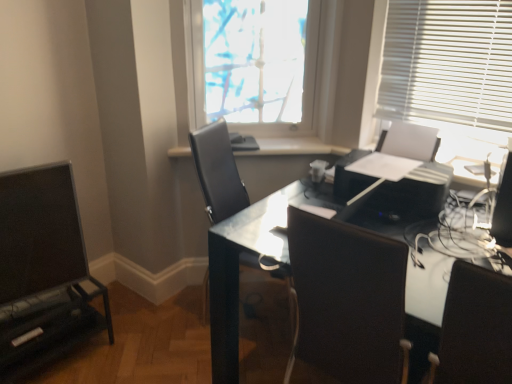
This screenshot has width=512, height=384. What are the coordinates of `free space underneath translucent fabric at upper center (from a real-world perspective)` in the screenshot? It's located at click(275, 135).